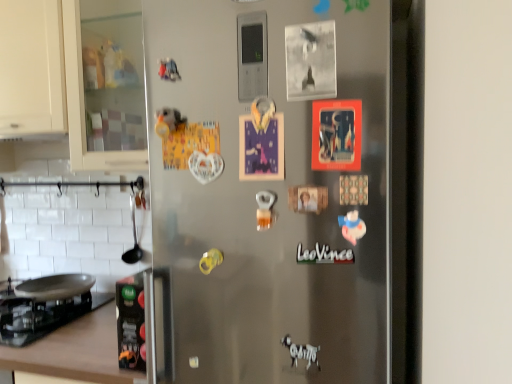
Locate an element on the screen. The image size is (512, 384). satin silver fridge at center is located at coordinates (268, 189).

Considering the relative sizes of black glass gas stove at lower left and satin silver fridge at center in the image provided, is black glass gas stove at lower left thinner than satin silver fridge at center?

In fact, black glass gas stove at lower left might be wider than satin silver fridge at center.

How far apart are black glass gas stove at lower left and satin silver fridge at center?

black glass gas stove at lower left is 23.13 inches from satin silver fridge at center.

Is black glass gas stove at lower left aimed at satin silver fridge at center?

No, black glass gas stove at lower left does not turn towards satin silver fridge at center.

Is black glass gas stove at lower left behind satin silver fridge at center?

That is True.

Is point (26, 333) less distant than point (73, 332)?

Yes, point (26, 333) is closer to viewer.

From a real-world perspective, is black glass gas stove at lower left above or below brown wood countertop at lower left?

Clearly, from a real-world perspective, black glass gas stove at lower left is above brown wood countertop at lower left.

Are black glass gas stove at lower left and brown wood countertop at lower left located far from each other?

They are positioned close to each other.

Between black glass gas stove at lower left and brown wood countertop at lower left, which one has larger size?

brown wood countertop at lower left is bigger.

Based on the photo, what's the angular difference between black glass gas stove at lower left and matte white text at center's facing directions?

They differ by 0.00428 degrees in their facing directions.

Looking at the image, does black glass gas stove at lower left seem bigger or smaller compared to matte white text at center?

In the image, black glass gas stove at lower left appears to be larger than matte white text at center.

Is black glass gas stove at lower left far from matte white text at center?

black glass gas stove at lower left is positioned a significant distance from matte white text at center.

Is black glass gas stove at lower left inside or outside of matte white text at center?

black glass gas stove at lower left is not enclosed by matte white text at center.

From a real-world perspective, is satin silver fridge at center physically below brown wood countertop at lower left?

Incorrect, from a real-world perspective, satin silver fridge at center is higher than brown wood countertop at lower left.

Is satin silver fridge at center not inside brown wood countertop at lower left?

Yes, satin silver fridge at center is located beyond the bounds of brown wood countertop at lower left.

Where is `counter top that appears behind the satin silver fridge at center`? counter top that appears behind the satin silver fridge at center is located at coordinates (75, 351).

Is satin silver fridge at center directly adjacent to brown wood countertop at lower left?

They are not placed beside each other.

Choose the correct answer: Is brown wood countertop at lower left inside matte white text at center or outside it?

brown wood countertop at lower left is not enclosed by matte white text at center.

Is brown wood countertop at lower left beside matte white text at center?

No, brown wood countertop at lower left is not in contact with matte white text at center.

From the image's perspective, is brown wood countertop at lower left located above or below matte white text at center?

Based on their image positions, brown wood countertop at lower left is located beneath matte white text at center.

Does matte white text at center turn towards satin silver fridge at center?

Yes, matte white text at center is facing satin silver fridge at center.

From the image's perspective, is matte white text at center over satin silver fridge at center?

No.

Does point (345, 261) lie behind point (166, 183)?

No, it is in front of (166, 183).

Does matte white text at center have a greater height compared to satin silver fridge at center?

In fact, matte white text at center may be shorter than satin silver fridge at center.

Does matte white text at center have a greater height compared to brown wood countertop at lower left?

In fact, matte white text at center may be shorter than brown wood countertop at lower left.

Consider the image. Considering the positions of objects matte white text at center and brown wood countertop at lower left in the image provided, who is behind, matte white text at center or brown wood countertop at lower left?

brown wood countertop at lower left.

How distant is matte white text at center from brown wood countertop at lower left?

matte white text at center is 32.55 inches from brown wood countertop at lower left.

Is matte white text at center at the right side of brown wood countertop at lower left?

Indeed, matte white text at center is positioned on the right side of brown wood countertop at lower left.

Where is `refrigerator on the right of black glass gas stove at lower left`? refrigerator on the right of black glass gas stove at lower left is located at coordinates (268, 189).

What are the coordinates of `counter top in front of the black glass gas stove at lower left` in the screenshot? It's located at pos(75,351).

When comparing their distances from satin silver fridge at center, does black glass gas stove at lower left or brown wood countertop at lower left seem closer?

brown wood countertop at lower left lies closer to satin silver fridge at center than the other object.

Which object lies further to the anchor point matte white text at center, black glass gas stove at lower left or brown wood countertop at lower left?

black glass gas stove at lower left lies further to matte white text at center than the other object.

Looking at the image, which one is located closer to black glass gas stove at lower left, satin silver fridge at center or brown wood countertop at lower left?

Among the two, brown wood countertop at lower left is located nearer to black glass gas stove at lower left.

Looking at the image, which one is located closer to brown wood countertop at lower left, satin silver fridge at center or matte white text at center?

Based on the image, satin silver fridge at center appears to be nearer to brown wood countertop at lower left.

From the image, which object appears to be farther from satin silver fridge at center, black glass gas stove at lower left or matte white text at center?

black glass gas stove at lower left lies further to satin silver fridge at center than the other object.

Looking at the image, which one is located closer to matte white text at center, satin silver fridge at center or brown wood countertop at lower left?

satin silver fridge at center is closer to matte white text at center.

When comparing their distances from brown wood countertop at lower left, does black glass gas stove at lower left or satin silver fridge at center seem closer?

Among the two, black glass gas stove at lower left is located nearer to brown wood countertop at lower left.

Considering their positions, is brown wood countertop at lower left positioned closer to black glass gas stove at lower left than satin silver fridge at center?

The object closer to black glass gas stove at lower left is brown wood countertop at lower left.

In order to click on refrigerator located between brown wood countertop at lower left and matte white text at center in the left-right direction in this screenshot , I will do `click(268, 189)`.

Find the location of `counter top between black glass gas stove at lower left and matte white text at center`. counter top between black glass gas stove at lower left and matte white text at center is located at coordinates (75, 351).

I want to click on refrigerator between black glass gas stove at lower left and matte white text at center, so click(268, 189).

The width and height of the screenshot is (512, 384). Find the location of `counter top located between black glass gas stove at lower left and satin silver fridge at center in the left-right direction`. counter top located between black glass gas stove at lower left and satin silver fridge at center in the left-right direction is located at coordinates [75, 351].